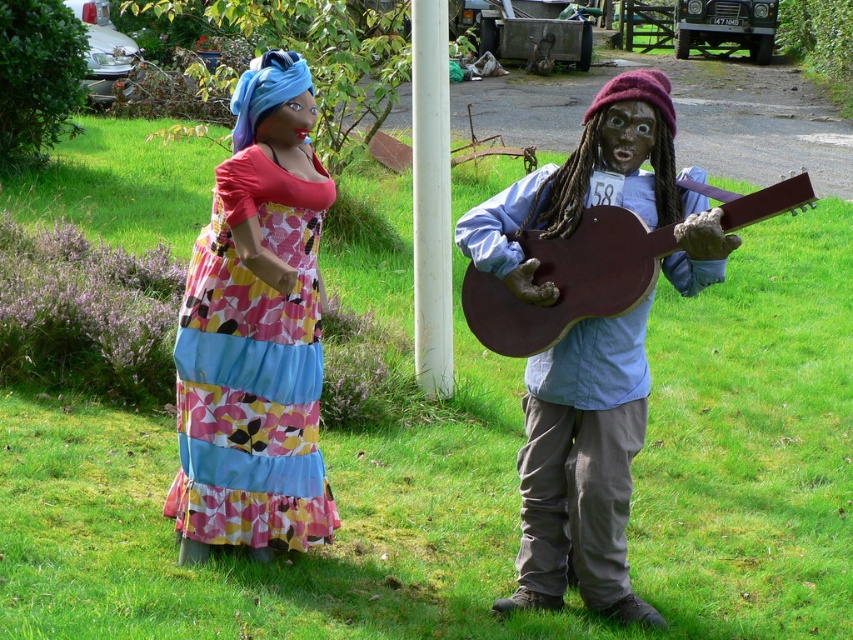
Question: Which of these objects is positioned closest to the matte fabric dress at left?

Choices:
 (A) brown matte guitar at right
 (B) floral fabric dress at left

Answer: (A)

Question: Which point is farther to the camera?

Choices:
 (A) floral fabric dress at left
 (B) brown matte guitar at right
 (C) matte brown guitar at center
 (D) matte fabric dress at left

Answer: (A)

Question: Does matte fabric dress at left lie in front of floral fabric dress at left?

Choices:
 (A) yes
 (B) no

Answer: (A)

Question: From the image, what is the correct spatial relationship of matte fabric dress at left in relation to brown matte guitar at right?

Choices:
 (A) right
 (B) left

Answer: (B)

Question: Among these points, which one is farthest from the camera?

Choices:
 (A) (619, 564)
 (B) (508, 305)
 (C) (289, 227)

Answer: (A)

Question: Does matte fabric dress at left have a lesser width compared to matte brown guitar at center?

Choices:
 (A) yes
 (B) no

Answer: (B)